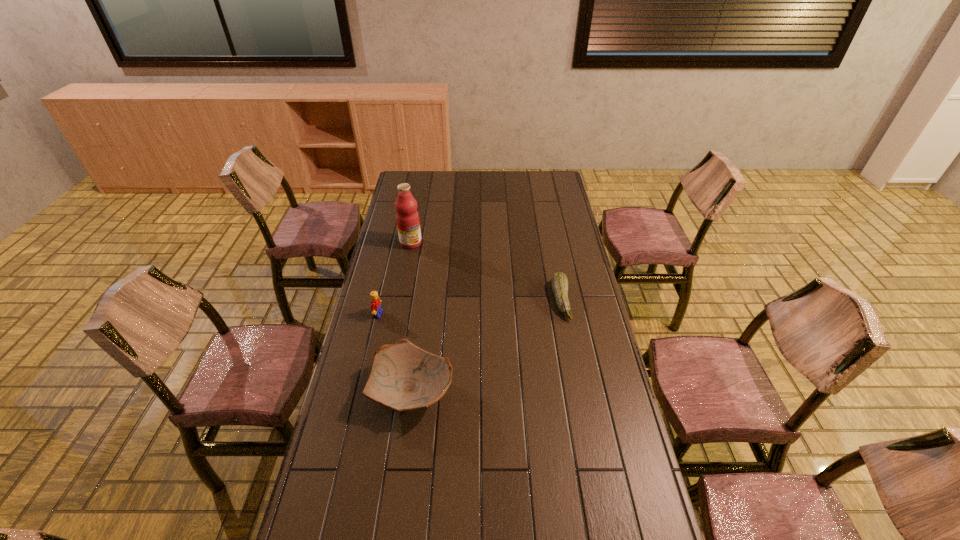
You are a GUI agent. You are given a task and a screenshot of the screen. Output one action in this format:
    pyautogui.click(x=<x>, y=<y>)
    Task: Click on the vacant point at the right edge
    Image resolution: width=960 pixels, height=540 pixels.
    Given the screenshot: What is the action you would take?
    pyautogui.click(x=564, y=247)

Where is `free space at the far left corner`? free space at the far left corner is located at coordinates (416, 180).

At what (x,y) coordinates should I click in order to perform the action: click on blank space at the far right corner of the desktop. Please return your answer as a coordinate pair (x, y). Looking at the image, I should click on (532, 179).

Locate an element on the screen. empty space between the nearest object and the zucchini is located at coordinates (487, 346).

The image size is (960, 540). In order to click on empty space between the leftmost object and the fruit juice in this screenshot , I will do `click(395, 279)`.

I want to click on free spot between the shortest object and the Lego, so click(469, 307).

This screenshot has height=540, width=960. Identify the location of free spot between the nearest object and the fruit juice. (412, 317).

What are the coordinates of `unoccupied area between the shortest object and the Lego` in the screenshot? It's located at (469, 307).

Identify the location of empty location between the rightmost object and the farthest object. (486, 272).

You are a GUI agent. You are given a task and a screenshot of the screen. Output one action in this format:
    pyautogui.click(x=<x>, y=<y>)
    Task: Click on the vacant area between the farthest object and the pottery
    The image size is (960, 540).
    Given the screenshot: What is the action you would take?
    pyautogui.click(x=412, y=317)